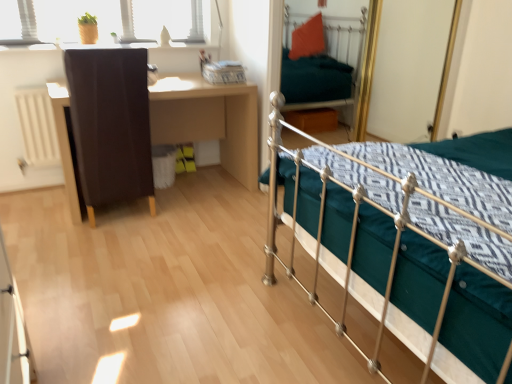
What are the coordinates of `vacant space to the right of matte brown cabinet at left` in the screenshot? It's located at (190, 218).